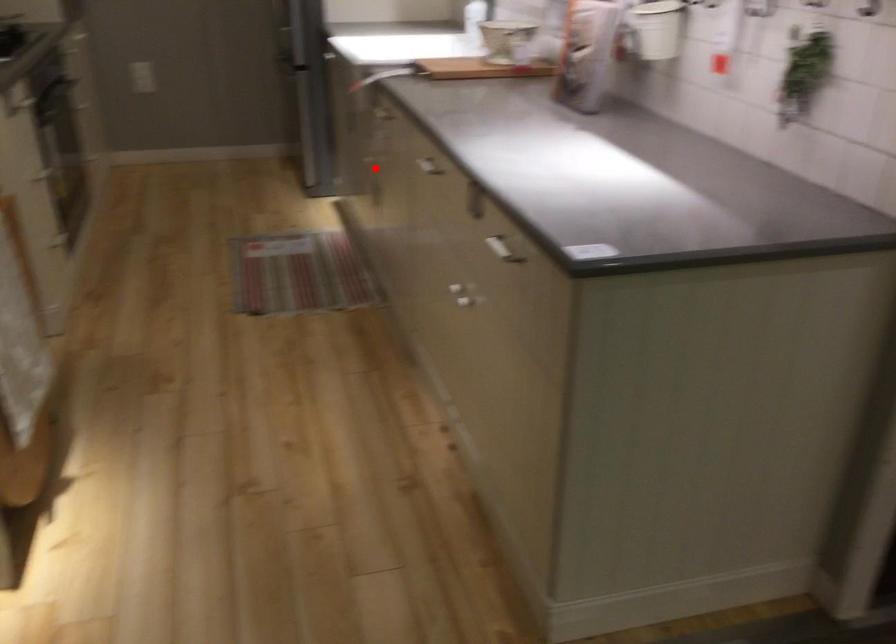
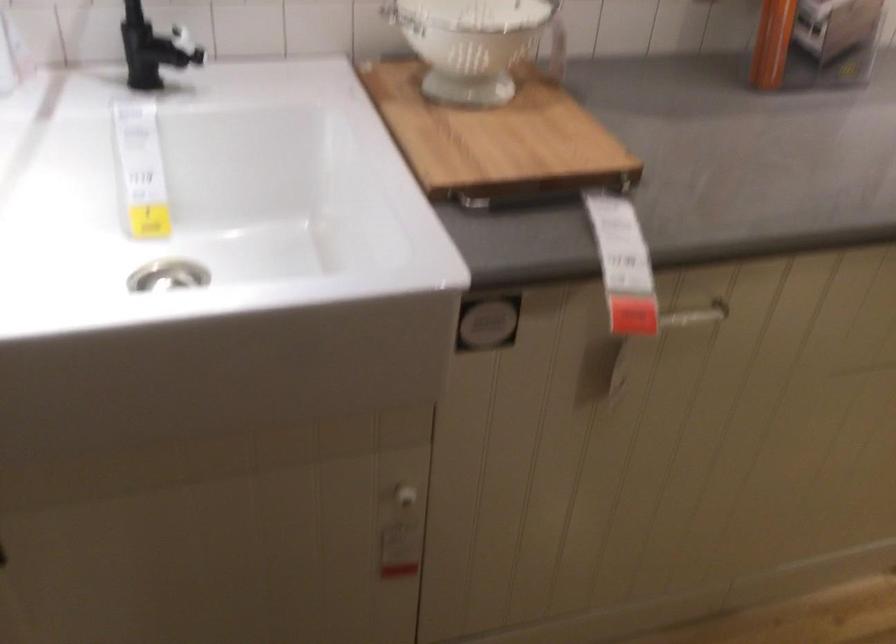
Question: A red point is marked in image1. In image2, is the corresponding 3D point closer to the camera or farther? Reply with the corresponding letter.

Choices:
 (A) The corresponding 3D point is closer.
 (B) The corresponding 3D point is farther.

Answer: (A)